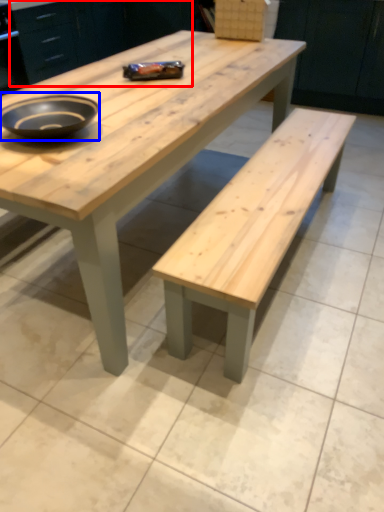
Question: Which of the following is the closest to the observer, cabinetry (highlighted by a red box) or bowl (highlighted by a blue box)?

Choices:
 (A) cabinetry
 (B) bowl

Answer: (B)